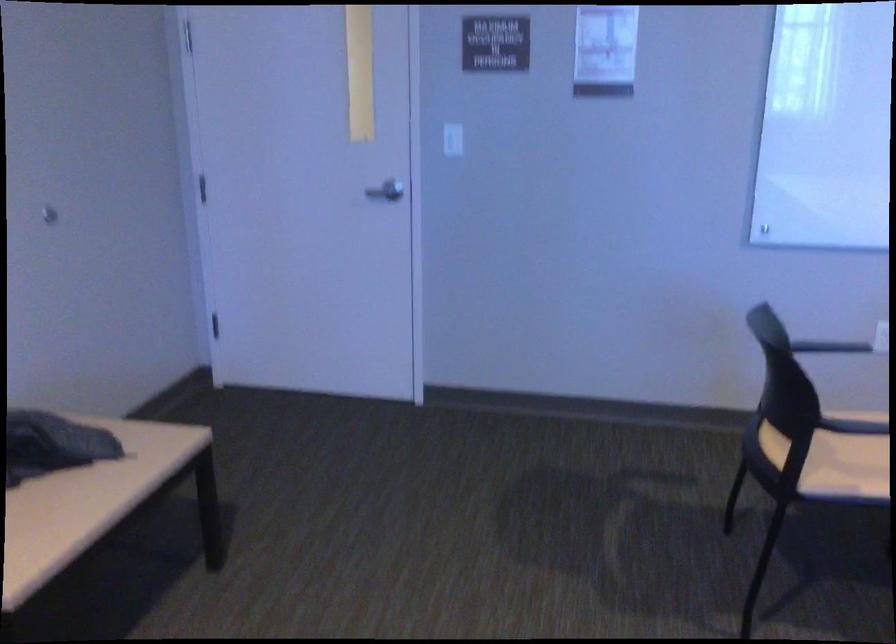
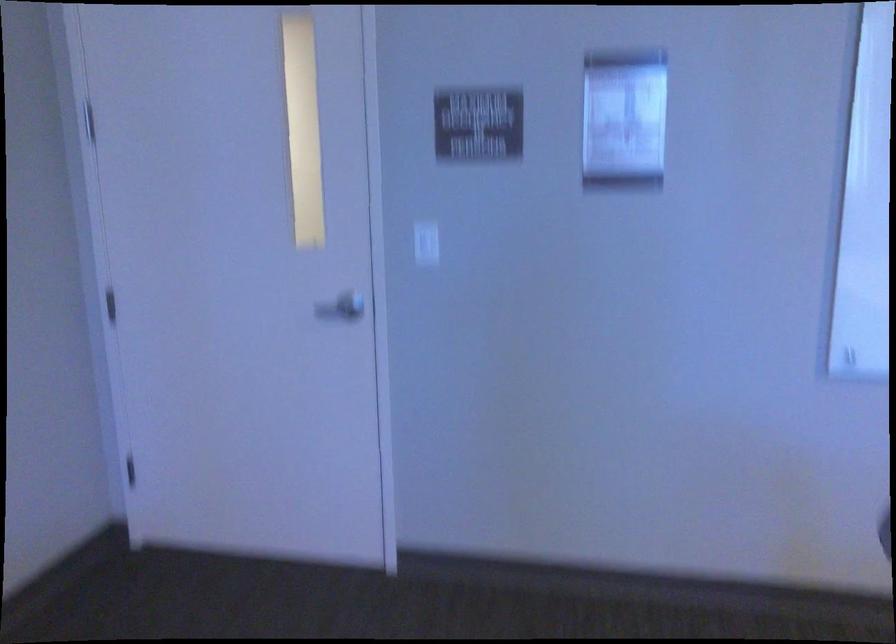
The point at (x=388, y=190) is marked in the first image. Where is the corresponding point in the second image?

(343, 306)